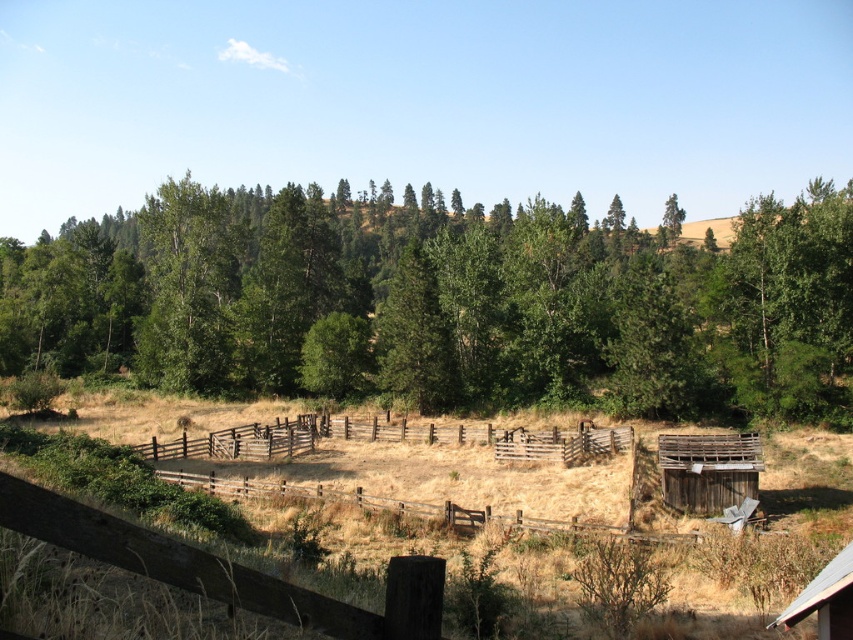
Is green matte tree at center shorter than wooden fence at center?

Incorrect, green matte tree at center's height does not fall short of wooden fence at center's.

Is point (120, 339) positioned behind point (227, 428)?

Yes, point (120, 339) is behind point (227, 428).

Who is more forward, (x=175, y=186) or (x=270, y=426)?

Point (x=270, y=426)

Identify the location of green matte tree at center. (444, 301).

Between rusty wooden barn at lower right and metallic silver barn at lower right, which one has more height?

rusty wooden barn at lower right is taller.

Which is above, rusty wooden barn at lower right or metallic silver barn at lower right?

metallic silver barn at lower right is higher up.

Which is behind, point (730, 483) or point (799, 604)?

The point (730, 483) is behind.

The width and height of the screenshot is (853, 640). What are the coordinates of `rusty wooden barn at lower right` in the screenshot? It's located at (708, 470).

Does point (409, 208) lie in front of point (737, 470)?

That is False.

Is green matte tree at center shorter than rusty wooden barn at lower right?

Incorrect, green matte tree at center's height does not fall short of rusty wooden barn at lower right's.

I want to click on green matte tree at center, so click(444, 301).

Where is `green matte tree at center`? This screenshot has height=640, width=853. green matte tree at center is located at coordinates (444, 301).